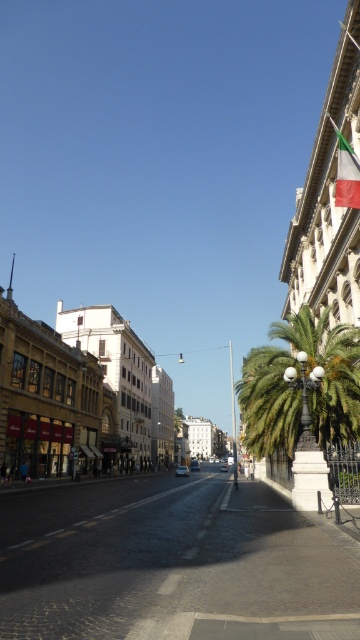
Can you confirm if green leafy palm tree at right is bigger than green fabric flag at upper right?

Indeed, green leafy palm tree at right has a larger size compared to green fabric flag at upper right.

Who is higher up, green leafy palm tree at right or green fabric flag at upper right?

Positioned higher is green fabric flag at upper right.

Does point (344, 339) lie in front of point (348, 145)?

That is False.

Image resolution: width=360 pixels, height=640 pixels. What are the coordinates of `green leafy palm tree at right` in the screenshot? It's located at (299, 388).